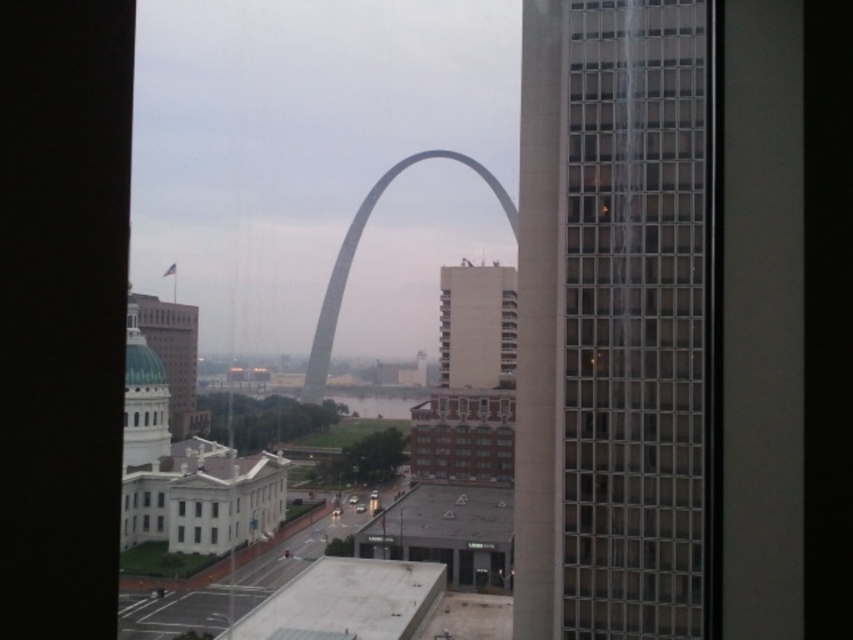
From the picture: You are standing inside the building and looking out the window. You see the white concrete building at center and the teal dome building at left. Which building is closer to your left side?

The teal dome building at left is closer to your left side because it is positioned to the left of the white concrete building at center.

You are a drone operator planning to fly a drone between the white concrete building at center and the teal dome building at left. The drone has a maximum flight distance of 70 meters. Can the drone safely make the trip between them without exceeding its range?

The distance between the white concrete building at center and the teal dome building at left is 73.85 meters, which exceeds the drone operator drone maximum flight distance of 70 meters. The drone cannot safely make the trip between them without exceeding its range.

You are an architect evaluating the cityscape. You need to determine which building, the white concrete building at center or the teal dome building at left, has a greater height. Based on the scene, which one is taller?

The white concrete building at center is taller than the teal dome building at left according to the description.